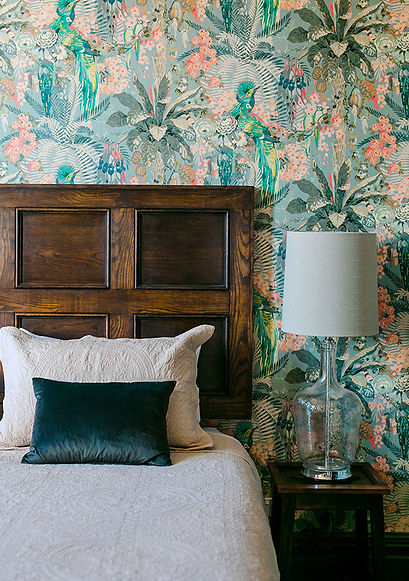
Identify the location of dark wood. (237, 293).